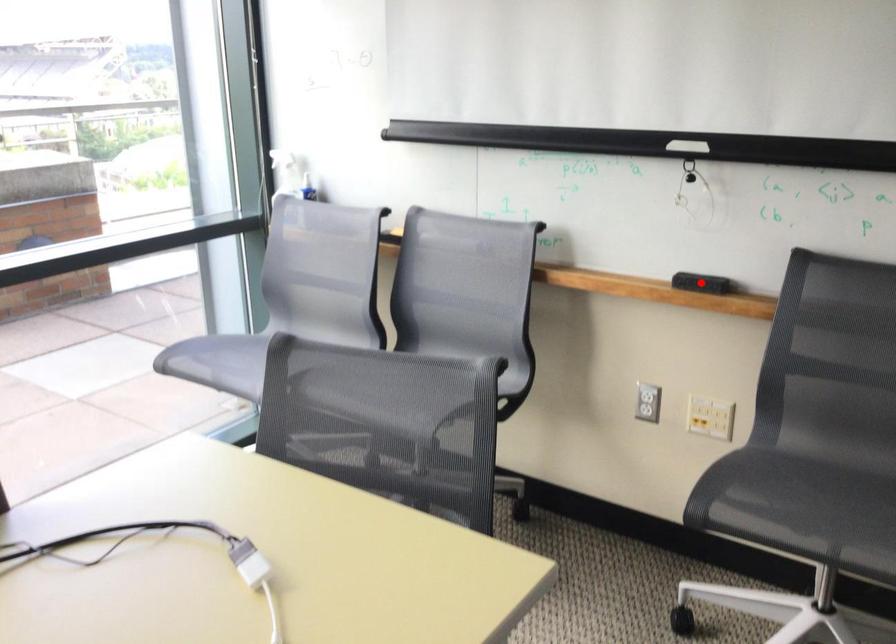
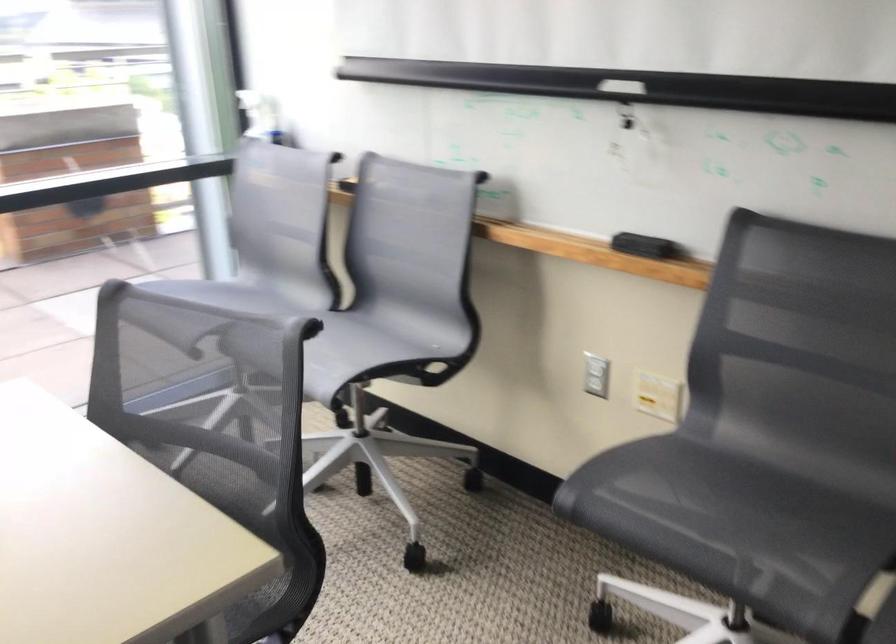
Locate, in the second image, the point that corresponds to the highlighted location in the first image.

(643, 245)